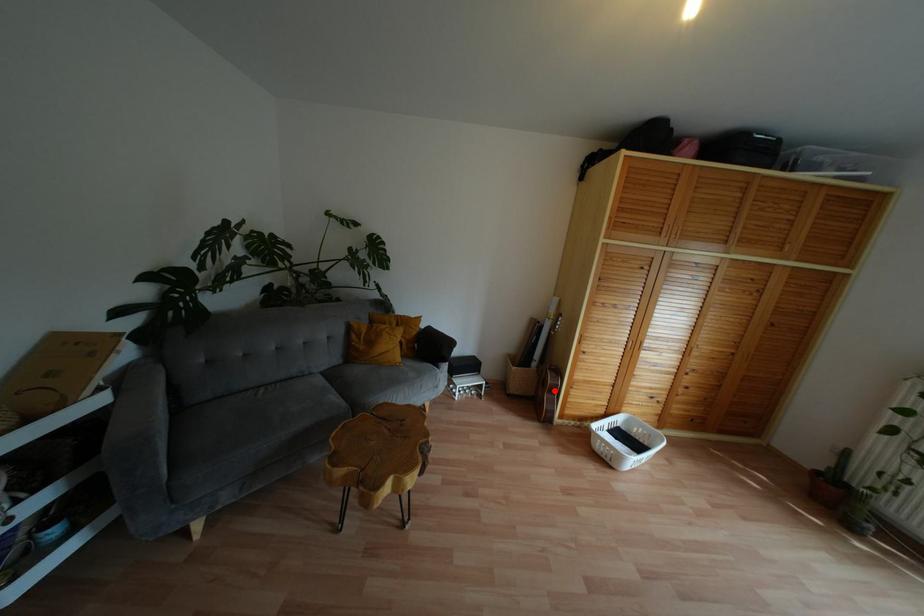
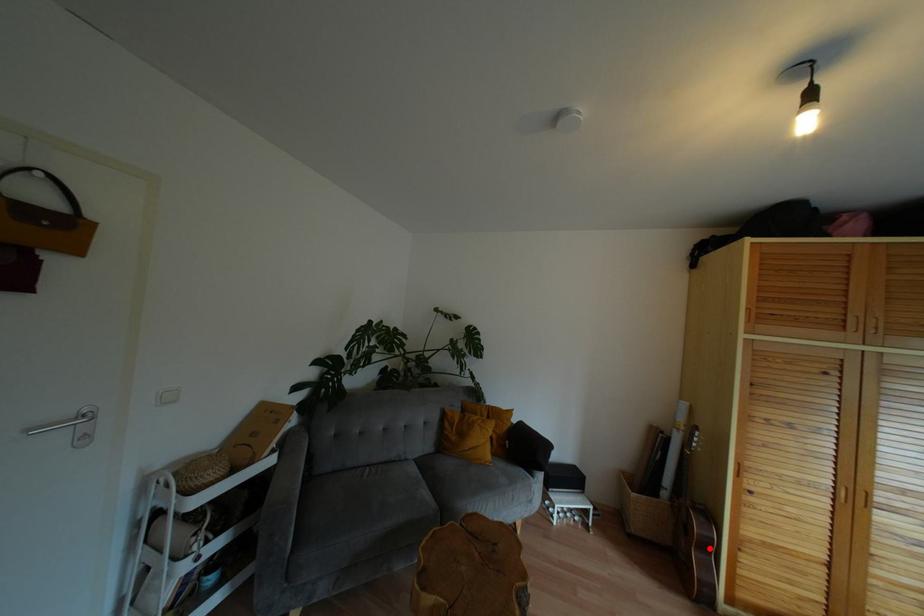
I am providing you with two images of the same scene from different viewpoints. A red point is marked on the first image and another point is marked on the second image. Do the highlighted points in image1 and image2 indicate the same real-world spot?

Yes